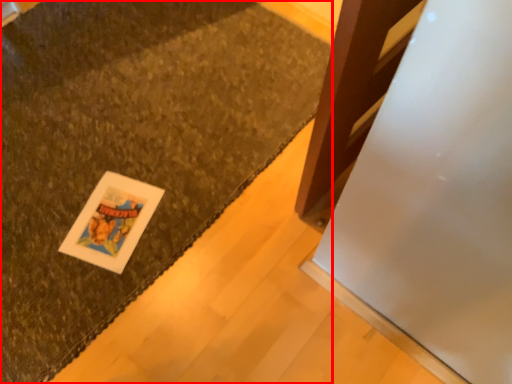
Question: Observing the image, what is the correct spatial positioning of mat (annotated by the red box) in reference to card?

Choices:
 (A) right
 (B) left

Answer: (B)